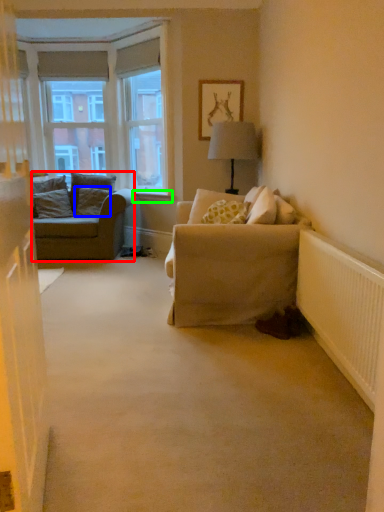
Question: Which object is positioned closest to studio couch (highlighted by a red box)? Select from pillow (highlighted by a blue box) and window sill (highlighted by a green box).

Choices:
 (A) pillow
 (B) window sill

Answer: (A)